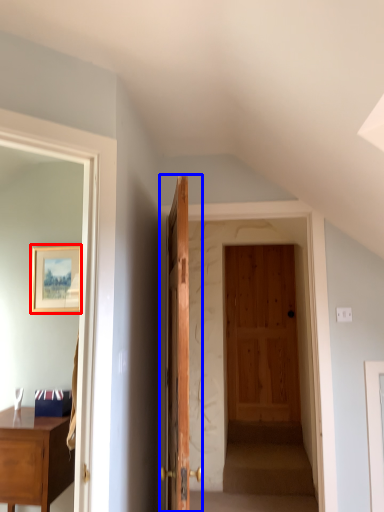
Question: Which object appears closest to the camera in this image, picture frame (highlighted by a red box) or door (highlighted by a blue box)?

Choices:
 (A) picture frame
 (B) door

Answer: (B)